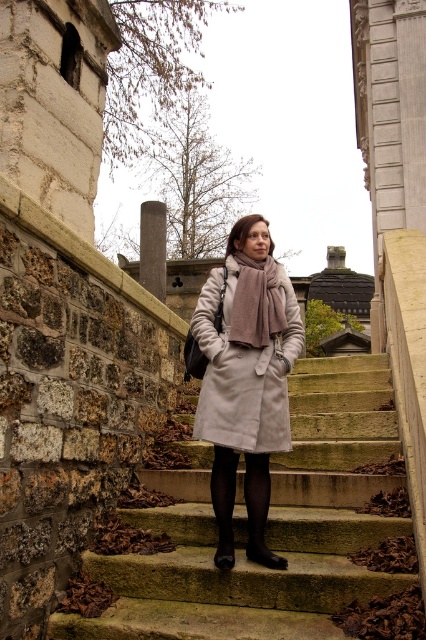
Which is above, brown woolen scarf at center or black leather boot at lower center?

Positioned higher is brown woolen scarf at center.

Is the position of brown woolen scarf at center less distant than that of black leather boot at lower center?

No, brown woolen scarf at center is further to the viewer.

Describe the element at coordinates (256, 304) in the screenshot. The image size is (426, 640). I see `brown woolen scarf at center` at that location.

Image resolution: width=426 pixels, height=640 pixels. Find the location of `brown woolen scarf at center`. brown woolen scarf at center is located at coordinates (256, 304).

Is smooth stone stairs at center positioned behind black tights at center?

No, it is in front of black tights at center.

Who is more forward, (137, 573) or (252, 460)?

Positioned in front is point (137, 573).

Who is more distant from viewer, (x=296, y=499) or (x=256, y=552)?

Point (x=296, y=499)

Where is `smooth stone stairs at center`? The height and width of the screenshot is (640, 426). smooth stone stairs at center is located at coordinates [267, 528].

Describe the element at coordinates (259, 509) in the screenshot. I see `black tights at center` at that location.

Can you confirm if black tights at center is smaller than brown woolen scarf at center?

Correct, black tights at center occupies less space than brown woolen scarf at center.

Is point (250, 524) positioned before point (236, 310)?

Yes, point (250, 524) is closer to viewer.

Where is `black tights at center`? black tights at center is located at coordinates (259, 509).